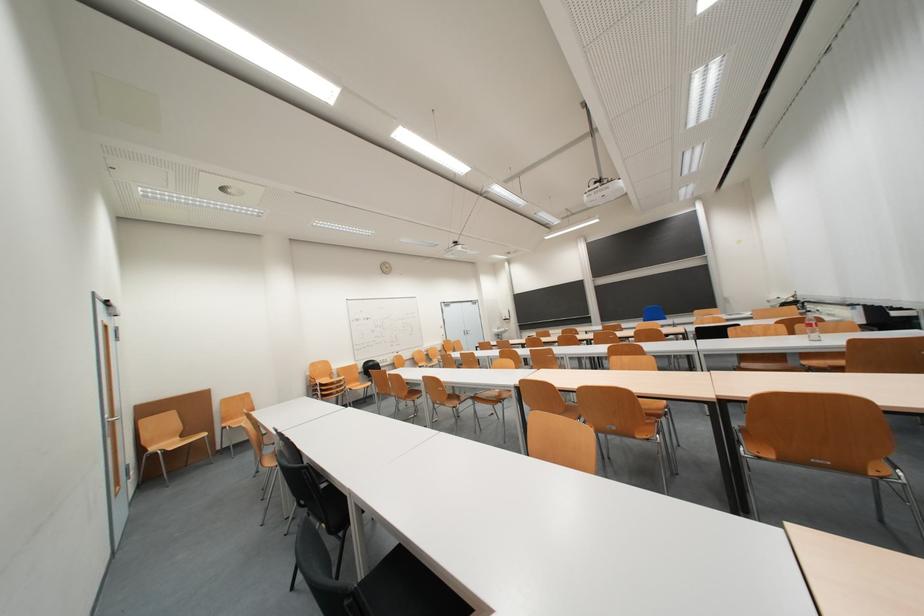
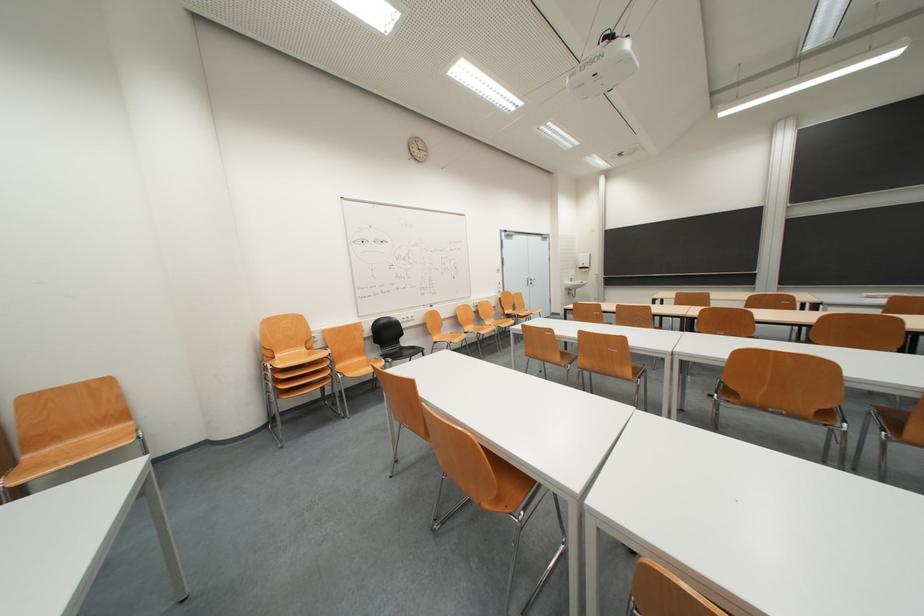
Question: In a continuous first-person perspective shot, in which direction is the camera moving?

Choices:
 (A) Left
 (B) Right
 (C) Forward
 (D) Backward

Answer: (C)